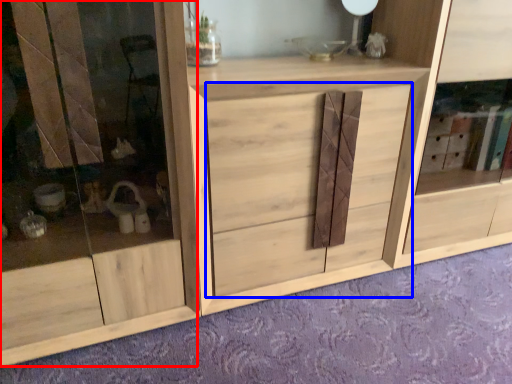
Question: Which of the following is the closest to the observer, screen door (highlighted by a red box) or drawer (highlighted by a blue box)?

Choices:
 (A) screen door
 (B) drawer

Answer: (A)